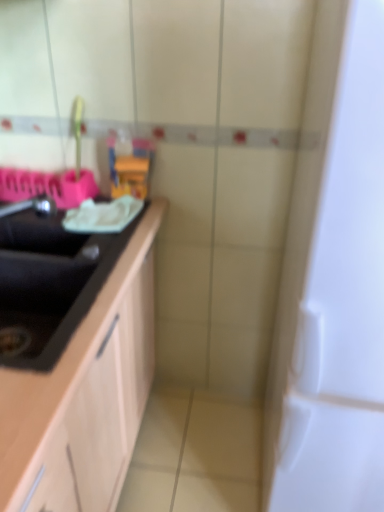
Question: Is translucent plastic toy at center not within black matte countertop at left?

Choices:
 (A) no
 (B) yes

Answer: (B)

Question: Is translucent plastic toy at center further to the viewer compared to black matte countertop at left?

Choices:
 (A) yes
 (B) no

Answer: (A)

Question: Is translucent plastic toy at center next to black matte countertop at left?

Choices:
 (A) no
 (B) yes

Answer: (A)

Question: Is the position of translucent plastic toy at center less distant than that of black matte countertop at left?

Choices:
 (A) yes
 (B) no

Answer: (B)

Question: Can you confirm if translucent plastic toy at center is positioned to the left of black matte countertop at left?

Choices:
 (A) no
 (B) yes

Answer: (A)

Question: From the image's perspective, is translucent plastic toy at center above or below white glossy door at right?

Choices:
 (A) below
 (B) above

Answer: (B)

Question: Considering the positions of translucent plastic toy at center and white glossy door at right in the image, is translucent plastic toy at center wider or thinner than white glossy door at right?

Choices:
 (A) thin
 (B) wide

Answer: (A)

Question: From a real-world perspective, is translucent plastic toy at center positioned above or below white glossy door at right?

Choices:
 (A) below
 (B) above

Answer: (B)

Question: In the image, is translucent plastic toy at center on the left side or the right side of white glossy door at right?

Choices:
 (A) right
 (B) left

Answer: (B)

Question: Considering the relative positions of translucent plastic toy at center and black matte sink at left in the image provided, is translucent plastic toy at center to the left or to the right of black matte sink at left?

Choices:
 (A) left
 (B) right

Answer: (B)

Question: From the image's perspective, is translucent plastic toy at center positioned above or below black matte sink at left?

Choices:
 (A) above
 (B) below

Answer: (A)

Question: From their relative heights in the image, would you say translucent plastic toy at center is taller or shorter than black matte sink at left?

Choices:
 (A) short
 (B) tall

Answer: (B)

Question: Is translucent plastic toy at center bigger or smaller than black matte sink at left?

Choices:
 (A) small
 (B) big

Answer: (A)

Question: Based on their sizes in the image, would you say black matte sink at left is bigger or smaller than translucent plastic toy at center?

Choices:
 (A) big
 (B) small

Answer: (A)

Question: From the image's perspective, is black matte sink at left positioned above or below translucent plastic toy at center?

Choices:
 (A) above
 (B) below

Answer: (B)